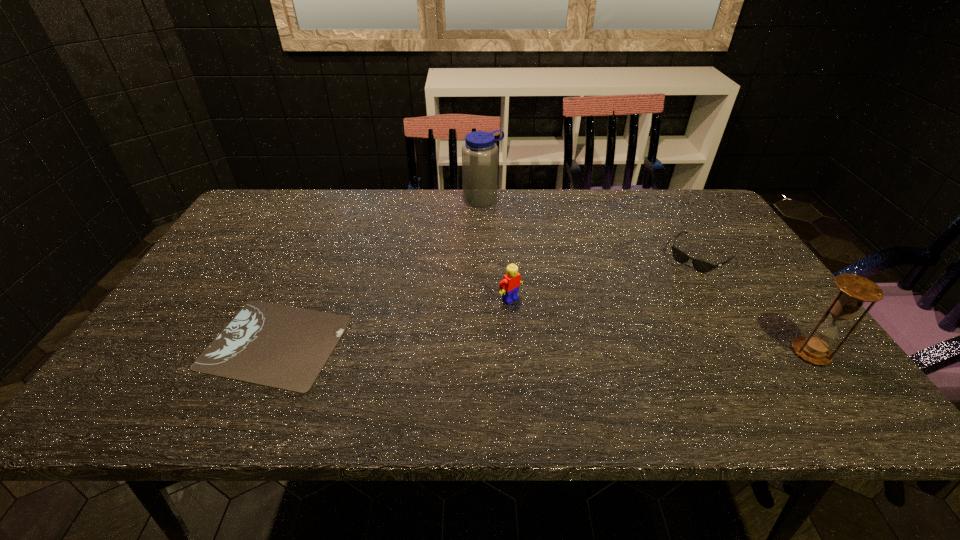
In order to click on vacant point that satisfies the following two spatial constraints: 1. on the back side of the leftmost object; 2. on the right side of the second shortest object in this screenshot , I will do point(315,255).